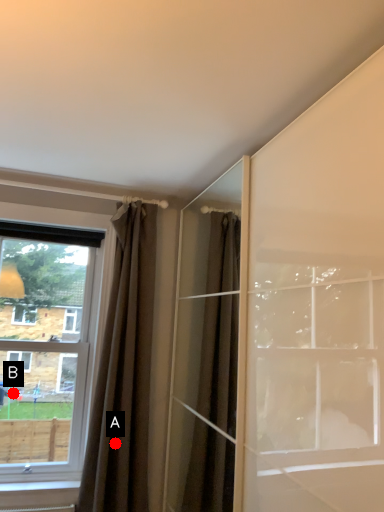
Question: Two points are circled on the image, labeled by A and B beside each circle. Which of the following is the closest to the observer?

Choices:
 (A) A is closer
 (B) B is closer

Answer: (A)